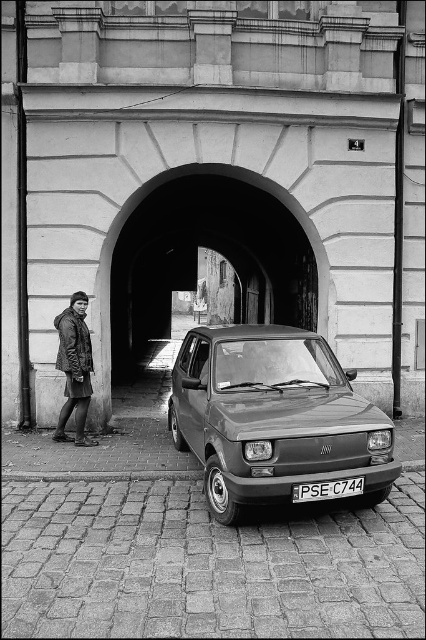
Is smooth stone archway at center to the left of white plastic license plate at center from the viewer's perspective?

Correct, you'll find smooth stone archway at center to the left of white plastic license plate at center.

Is point (167, 180) more distant than point (321, 497)?

Yes.

Find the location of a particular element. The height and width of the screenshot is (640, 426). smooth stone archway at center is located at coordinates (135, 209).

At what (x,y) coordinates should I click in order to perform the action: click on smooth stone archway at center. Please return your answer as a coordinate pair (x, y). Looking at the image, I should click on (135, 209).

Between point (83, 348) and point (322, 483), which one is positioned behind?

Positioned behind is point (83, 348).

Between point (71, 404) and point (359, 481), which one is positioned behind?

The point (71, 404) is behind.

Where is `dark gray jacket at left`? dark gray jacket at left is located at coordinates (74, 369).

Is smooth stone archway at center bigger than dark gray jacket at left?

Indeed, smooth stone archway at center has a larger size compared to dark gray jacket at left.

Who is more distant from viewer, (x=321, y=275) or (x=68, y=381)?

Point (x=321, y=275)

Is point (103, 284) behind point (65, 330)?

That is True.

Locate an element on the screen. smooth stone archway at center is located at coordinates (135, 209).